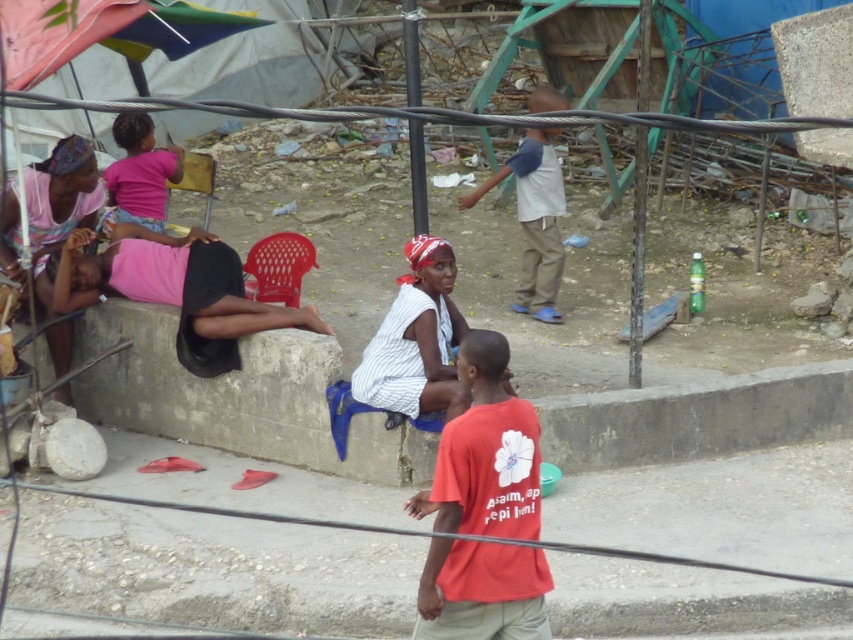
Who is lower down, white striped dress at center or matte pink dress at left?

white striped dress at center is lower down.

How distant is white striped dress at center from matte pink dress at left?

white striped dress at center and matte pink dress at left are 6.32 feet apart.

Find the location of a particular element. This screenshot has width=853, height=640. white striped dress at center is located at coordinates (416, 340).

At what (x,y) coordinates should I click in order to perform the action: click on white striped dress at center. Please return your answer as a coordinate pair (x, y). Looking at the image, I should click on (416, 340).

Who is positioned more to the left, red cotton shirt at center or pink fabric skirt at lower left?

Positioned to the left is pink fabric skirt at lower left.

Does red cotton shirt at center have a greater height compared to pink fabric skirt at lower left?

Yes, red cotton shirt at center is taller than pink fabric skirt at lower left.

Locate an element on the screen. Image resolution: width=853 pixels, height=640 pixels. red cotton shirt at center is located at coordinates (485, 452).

I want to click on red cotton shirt at center, so click(x=485, y=452).

Can you confirm if light blue denim pants at center is taller than pink fabric at upper left?

Yes.

From the picture: Can you confirm if light blue denim pants at center is positioned to the left of pink fabric at upper left?

Incorrect, light blue denim pants at center is not on the left side of pink fabric at upper left.

You are a GUI agent. You are given a task and a screenshot of the screen. Output one action in this format:
    pyautogui.click(x=<x>, y=<y>)
    Task: Click on the light blue denim pants at center
    This screenshot has height=640, width=853.
    Given the screenshot: What is the action you would take?
    pyautogui.click(x=534, y=220)